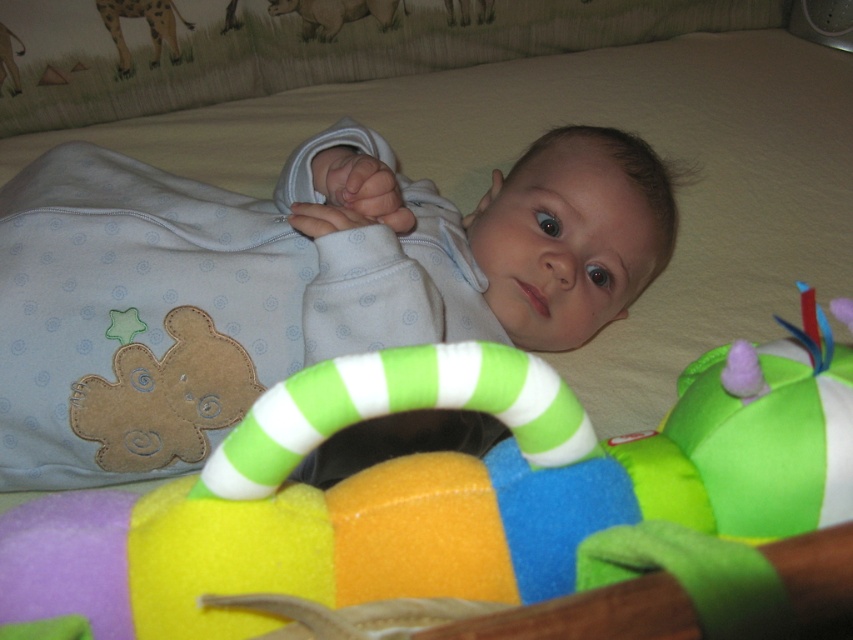
You are a parent checking on your baby in the crib. You see the matte white onesie at center and the spotted fur giraffe at upper left. Which object is closer to the baby?

The matte white onesie at center is positioned under the spotted fur giraffe at upper left, so the matte white onesie at center is closer to the baby.

The baby is wearing a light blue onesie with small, light blue spiral patterns and a brown gingerbread man applique on the left side. However, there is a point at coordinates (477, 243). What object is located at this point?

The point at coordinates (477, 243) indicates the matte white onesie at center.

Where is the matte white onesie at center located in the image?

The matte white onesie at center is located at the 2D coordinates point (477, 243).